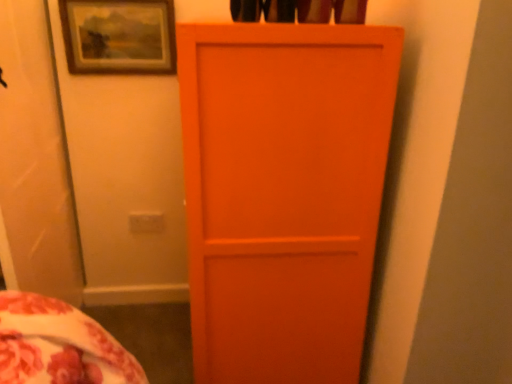
The width and height of the screenshot is (512, 384). Find the location of `wooden framed painting at upper left`. wooden framed painting at upper left is located at coordinates (119, 36).

Describe the element at coordinates (119, 36) in the screenshot. I see `wooden framed painting at upper left` at that location.

The width and height of the screenshot is (512, 384). Identify the location of wooden framed painting at upper left. (119, 36).